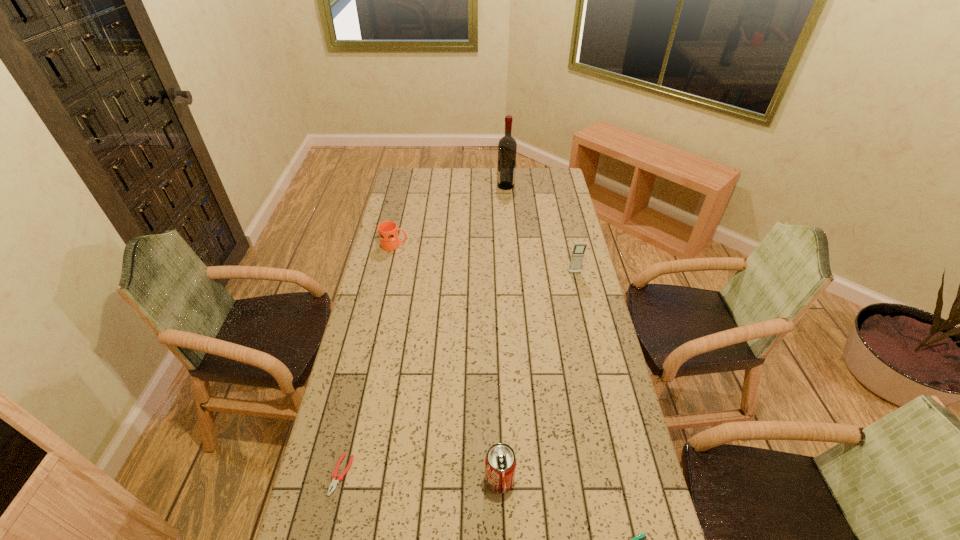
Where is `vacant space at the left edge`? vacant space at the left edge is located at coordinates (376, 330).

Find the location of a particular element. The height and width of the screenshot is (540, 960). vacant space at the right edge of the desktop is located at coordinates (588, 450).

In the image, there is a desktop. At what (x,y) coordinates should I click in order to perform the action: click on free region at the far left corner. Please return your answer as a coordinate pair (x, y). Looking at the image, I should click on (424, 175).

In order to click on vacant area between the farther pliers and the fourth shortest object in this screenshot , I will do `click(420, 477)`.

You are a GUI agent. You are given a task and a screenshot of the screen. Output one action in this format:
    pyautogui.click(x=<x>, y=<y>)
    Task: Click on the free space that is in between the left pliers and the fourth tallest object
    Image resolution: width=960 pixels, height=540 pixels.
    Given the screenshot: What is the action you would take?
    pyautogui.click(x=368, y=360)

Locate an element on the screen. The height and width of the screenshot is (540, 960). free spot between the left pliers and the fourth tallest object is located at coordinates click(x=368, y=360).

I want to click on vacant space in between the pop soda and the fourth nearest object, so click(538, 376).

Locate an element on the screen. vacant space that is in between the second farthest object and the fifth shortest object is located at coordinates (485, 259).

The image size is (960, 540). What are the coordinates of `vacant area between the pop soda and the third shortest object` in the screenshot? It's located at (447, 362).

You are a GUI agent. You are given a task and a screenshot of the screen. Output one action in this format:
    pyautogui.click(x=<x>, y=<y>)
    Task: Click on the empty space that is in between the left pliers and the cellular telephone
    
    Given the screenshot: What is the action you would take?
    [x=458, y=374]